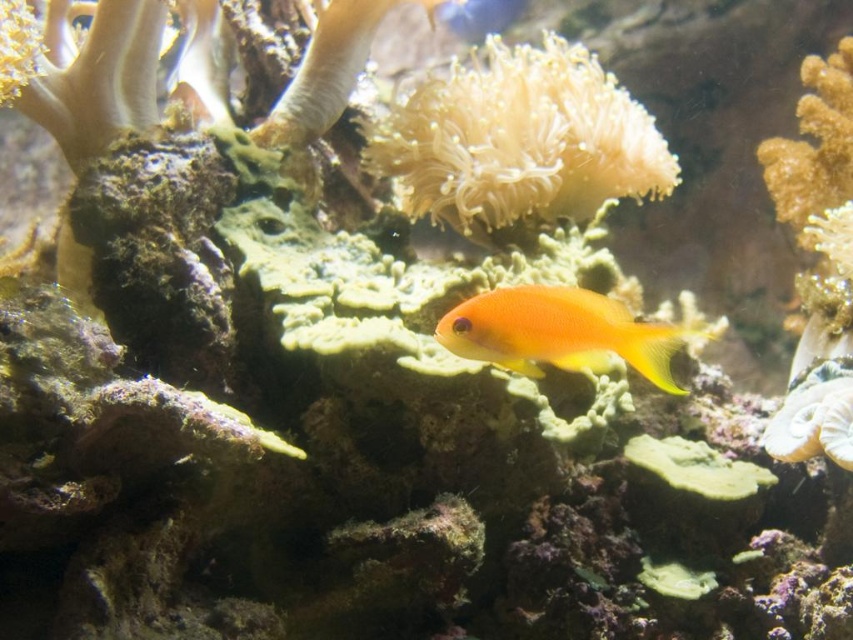
Question: Which point is farther to the camera?

Choices:
 (A) (575, 150)
 (B) (566, 355)

Answer: (A)

Question: From the image, what is the correct spatial relationship of soft white coral at center in relation to bright orange fish at center?

Choices:
 (A) below
 (B) above

Answer: (B)

Question: Is soft white coral at center further to camera compared to bright orange fish at center?

Choices:
 (A) no
 (B) yes

Answer: (B)

Question: Observing the image, what is the correct spatial positioning of soft white coral at center in reference to bright orange fish at center?

Choices:
 (A) right
 (B) left

Answer: (A)

Question: Which point appears closest to the camera in this image?

Choices:
 (A) (509, 216)
 (B) (515, 316)

Answer: (B)